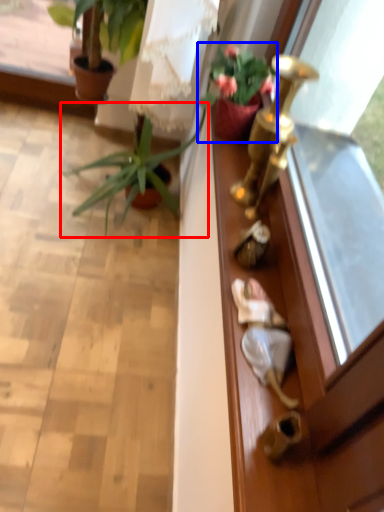
Question: Which of the following is the farthest to the observer, houseplant (highlighted by a red box) or houseplant (highlighted by a blue box)?

Choices:
 (A) houseplant
 (B) houseplant

Answer: (A)